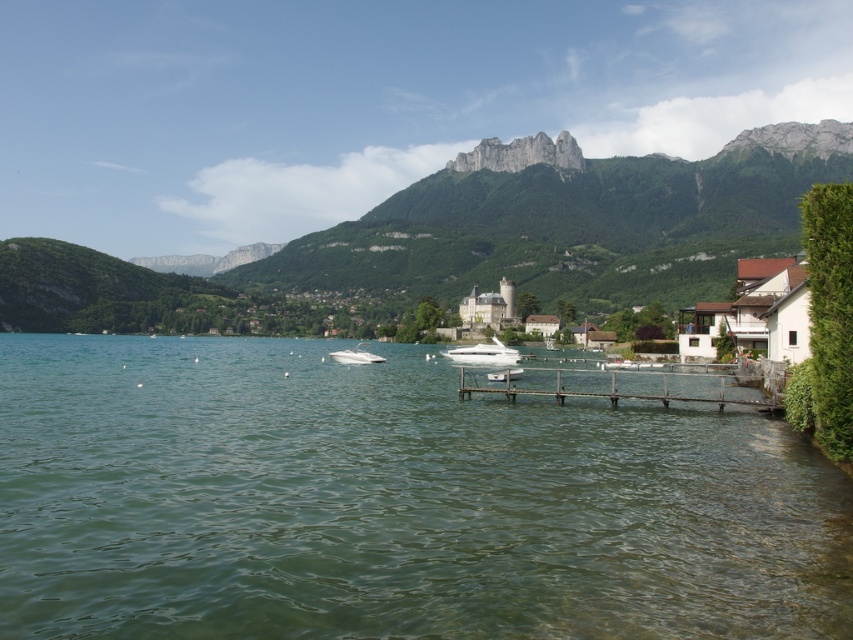
Is brown wooden dock at lower center wider than white glossy motorboat at center?

Yes, brown wooden dock at lower center is wider than white glossy motorboat at center.

Based on the photo, between brown wooden dock at lower center and white glossy motorboat at center, which one appears on the left side from the viewer's perspective?

Positioned to the left is white glossy motorboat at center.

The height and width of the screenshot is (640, 853). I want to click on brown wooden dock at lower center, so click(616, 387).

Does white glossy motorboat at center have a smaller size compared to white glossy boat at center?

No.

Consider the image. Does white glossy motorboat at center have a larger size compared to white glossy boat at center?

Correct, white glossy motorboat at center is larger in size than white glossy boat at center.

You are a GUI agent. You are given a task and a screenshot of the screen. Output one action in this format:
    pyautogui.click(x=<x>, y=<y>)
    Task: Click on the white glossy motorboat at center
    This screenshot has height=640, width=853.
    Given the screenshot: What is the action you would take?
    pyautogui.click(x=483, y=353)

Can you confirm if green water at center is shorter than green grassy mountain at upper center?

Yes, green water at center is shorter than green grassy mountain at upper center.

Can you confirm if green water at center is wider than green grassy mountain at upper center?

No.

The image size is (853, 640). I want to click on green water at center, so click(392, 502).

This screenshot has height=640, width=853. Identify the location of green water at center. (392, 502).